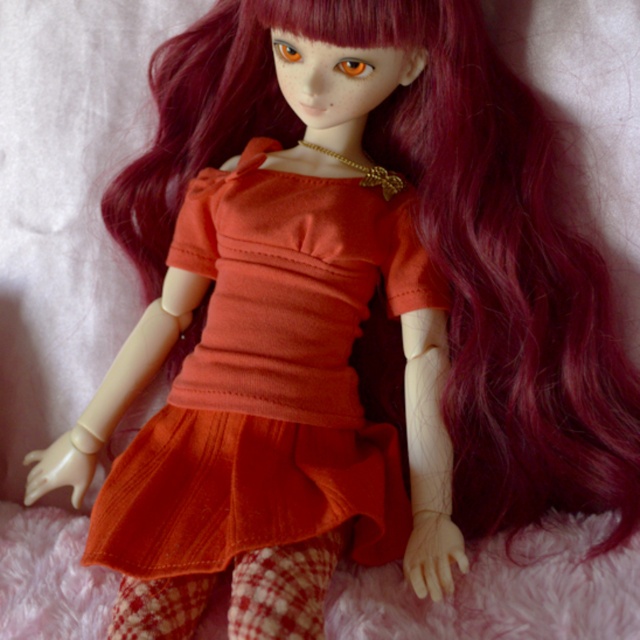
Question: Which of the following is the farthest from the observer?

Choices:
 (A) matte orange fabric dress at center
 (B) fuzzy pink blanket at lower center

Answer: (A)

Question: Which point is farther from the camera taking this photo?

Choices:
 (A) (x=602, y=524)
 (B) (x=234, y=528)

Answer: (A)

Question: Is matte orange fabric dress at center bigger than fuzzy pink blanket at lower center?

Choices:
 (A) no
 (B) yes

Answer: (B)

Question: Is matte orange fabric dress at center to the left of fuzzy pink blanket at lower center from the viewer's perspective?

Choices:
 (A) no
 (B) yes

Answer: (B)

Question: Does matte orange fabric dress at center appear on the left side of fuzzy pink blanket at lower center?

Choices:
 (A) yes
 (B) no

Answer: (A)

Question: Which object appears farthest from the camera in this image?

Choices:
 (A) matte orange fabric dress at center
 (B) fuzzy pink blanket at lower center

Answer: (A)